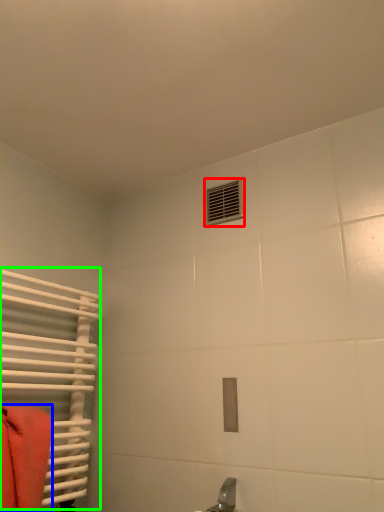
Question: Which object is the farthest from air conditioning (highlighted by a red box)? Choose among these: towel (highlighted by a blue box) or radiator (highlighted by a green box).

Choices:
 (A) towel
 (B) radiator

Answer: (A)